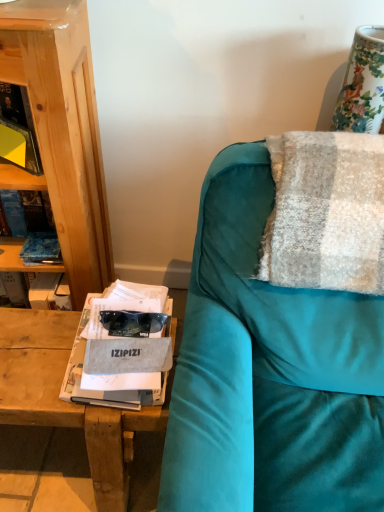
This screenshot has height=512, width=384. Describe the element at coordinates (362, 84) in the screenshot. I see `porcelain floral vase at upper right` at that location.

This screenshot has height=512, width=384. What do you see at coordinates (107, 378) in the screenshot? I see `gray fabric magazine at left` at bounding box center [107, 378].

Identify the location of textured woolen blanket at right. The image size is (384, 512). (326, 212).

How many degrees apart are the facing directions of gray fabric magazine at left and porcelain floral vase at upper right?

The angle between the facing direction of gray fabric magazine at left and the facing direction of porcelain floral vase at upper right is 3.34 degrees.

In the scene shown: Between gray fabric magazine at left and porcelain floral vase at upper right, which one has more height?

porcelain floral vase at upper right.

Does gray fabric magazine at left touch porcelain floral vase at upper right?

gray fabric magazine at left is not next to porcelain floral vase at upper right, and they're not touching.

Which is nearer, (73, 366) or (360, 112)?

The point (73, 366) is more forward.

Does point (314, 188) come in front of point (347, 95)?

Yes.

How distant is textured woolen blanket at right from porcelain floral vase at upper right?

A distance of 12.38 inches exists between textured woolen blanket at right and porcelain floral vase at upper right.

Which object is further away from the camera taking this photo, textured woolen blanket at right or porcelain floral vase at upper right?

A: porcelain floral vase at upper right is further away from the camera.

Is textured woolen blanket at right aimed at porcelain floral vase at upper right?

No, textured woolen blanket at right does not turn towards porcelain floral vase at upper right.

Looking at this image, is porcelain floral vase at upper right positioned before gray fabric magazine at left?

No, porcelain floral vase at upper right is further to the viewer.

Does porcelain floral vase at upper right have a larger size compared to gray fabric magazine at left?

Incorrect, porcelain floral vase at upper right is not larger than gray fabric magazine at left.

I want to click on magazine lying in front of the porcelain floral vase at upper right, so click(107, 378).

Which object is positioned more to the right, porcelain floral vase at upper right or gray fabric magazine at left?

From the viewer's perspective, porcelain floral vase at upper right appears more on the right side.

Looking at this image, can you confirm if porcelain floral vase at upper right is thinner than textured woolen blanket at right?

Yes.

Between porcelain floral vase at upper right and textured woolen blanket at right, which one has more height?

porcelain floral vase at upper right is taller.

You are a GUI agent. You are given a task and a screenshot of the screen. Output one action in this format:
    pyautogui.click(x=<x>, y=<y>)
    Task: Click on the table lamp above the textured woolen blanket at right (from the image's perspective)
    Image resolution: width=384 pixels, height=512 pixels.
    Given the screenshot: What is the action you would take?
    pyautogui.click(x=362, y=84)

How far apart are porcelain floral vase at upper right and textured woolen blanket at right?

The distance of porcelain floral vase at upper right from textured woolen blanket at right is 12.38 inches.

Is gray fabric magazine at left to the left of textured woolen blanket at right from the viewer's perspective?

Yes.

Is gray fabric magazine at left with textured woolen blanket at right?

gray fabric magazine at left is not next to textured woolen blanket at right, and they're not touching.

Between gray fabric magazine at left and textured woolen blanket at right, which one has smaller size?

gray fabric magazine at left is smaller.

From the image's perspective, between gray fabric magazine at left and textured woolen blanket at right, which one is located above?

From the image's view, textured woolen blanket at right is above.

You are a GUI agent. You are given a task and a screenshot of the screen. Output one action in this format:
    pyautogui.click(x=<x>, y=<y>)
    Task: Click on the pillow positioned vertically above the gray fabric magazine at left (from a real-world perspective)
    This screenshot has width=384, height=512.
    Given the screenshot: What is the action you would take?
    pyautogui.click(x=326, y=212)

Could you tell me if textured woolen blanket at right is turned towards gray fabric magazine at left?

No, textured woolen blanket at right does not turn towards gray fabric magazine at left.

Which is more to the left, textured woolen blanket at right or gray fabric magazine at left?

Positioned to the left is gray fabric magazine at left.

This screenshot has height=512, width=384. What are the coordinates of `magazine that appears below the porcelain floral vase at upper right (from the image's perspective)` in the screenshot? It's located at (107, 378).

Image resolution: width=384 pixels, height=512 pixels. Find the location of `table lamp lying on the right of textured woolen blanket at right`. table lamp lying on the right of textured woolen blanket at right is located at coordinates (362, 84).

Based on their spatial positions, is porcelain floral vase at upper right or gray fabric magazine at left further from textured woolen blanket at right?

gray fabric magazine at left lies further to textured woolen blanket at right than the other object.

Estimate the real-world distances between objects in this image. Which object is further from gray fabric magazine at left, textured woolen blanket at right or porcelain floral vase at upper right?

Among the two, porcelain floral vase at upper right is located further to gray fabric magazine at left.

Looking at this image, from the image, which object appears to be nearer to porcelain floral vase at upper right, textured woolen blanket at right or gray fabric magazine at left?

The object closer to porcelain floral vase at upper right is textured woolen blanket at right.

Looking at the image, which one is located closer to gray fabric magazine at left, porcelain floral vase at upper right or textured woolen blanket at right?

textured woolen blanket at right is positioned closer to the anchor gray fabric magazine at left.

From the image, which object appears to be nearer to textured woolen blanket at right, gray fabric magazine at left or porcelain floral vase at upper right?

The object closer to textured woolen blanket at right is porcelain floral vase at upper right.

From the image, which object appears to be farther from porcelain floral vase at upper right, gray fabric magazine at left or textured woolen blanket at right?

gray fabric magazine at left is positioned further to the anchor porcelain floral vase at upper right.

This screenshot has height=512, width=384. I want to click on pillow between gray fabric magazine at left and porcelain floral vase at upper right from left to right, so click(326, 212).